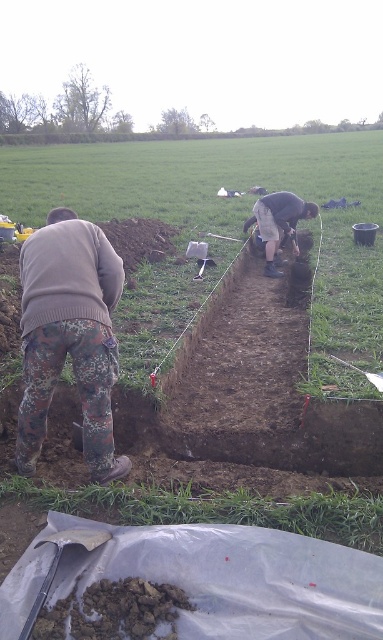
What is the location of the point labeled as point (278, 224) in the image?

The point labeled as point (278, 224) is on dark gray concrete squat at center.

You are an archaeologist at the excavation site. You need to place a protective cover over the dark gray concrete squat at center. The cover can only be placed if the object is taller than the black plastic shovel at lower left. Can you place the cover?

The dark gray concrete squat at center is taller than the black plastic shovel at lower left, so yes, you can place the protective cover over it.

You are a photographer at the archaeological site. You want to take a photo that includes both points, point (101,276) and point (273,243). To ensure both are in focus, you need to know which point is closer to the camera. Which point is closer?

Point (101,276) is closer to the camera than point (273,243).